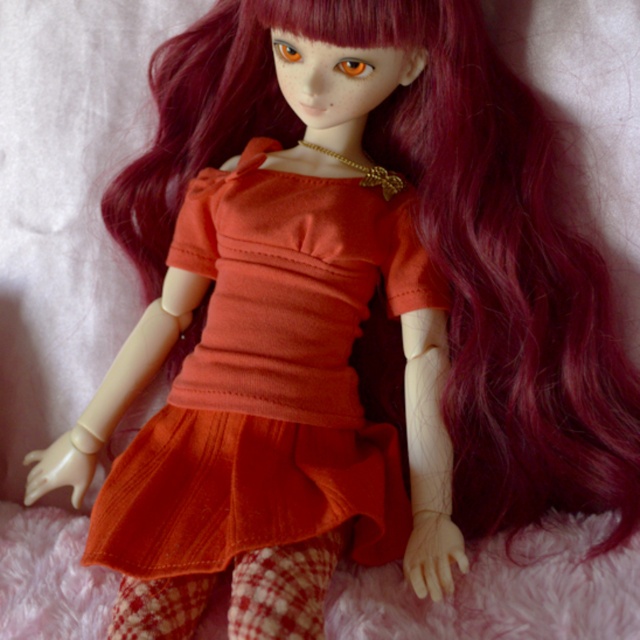
Is matte orange fabric dress at center above fuzzy pink blanket at lower center?

Correct, matte orange fabric dress at center is located above fuzzy pink blanket at lower center.

Is matte orange fabric dress at center bigger than fuzzy pink blanket at lower center?

Yes.

Locate an element on the screen. The width and height of the screenshot is (640, 640). matte orange fabric dress at center is located at coordinates (269, 380).